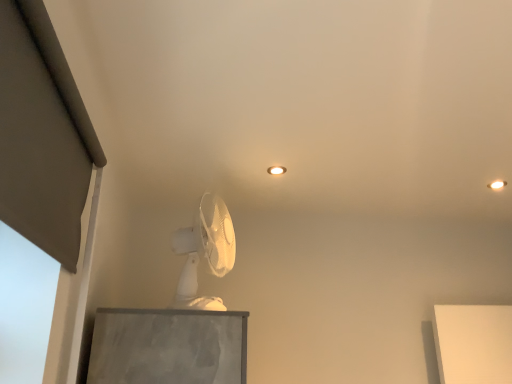
Where is `white plastic fan at center`? The height and width of the screenshot is (384, 512). white plastic fan at center is located at coordinates (205, 252).

Describe the element at coordinates (205, 252) in the screenshot. I see `white plastic fan at center` at that location.

What are the coordinates of `white plastic fan at center` in the screenshot? It's located at (205, 252).